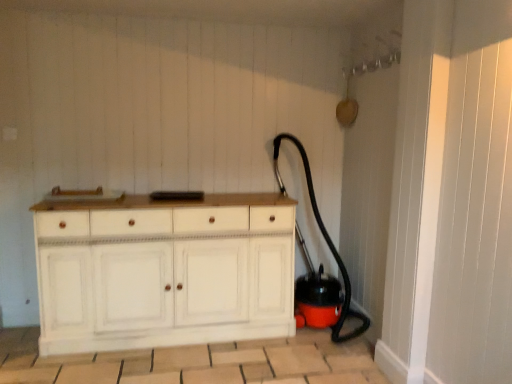
Question: Is white wood chest of drawers at center spatially inside black rubber garden hose at lower right, or outside of it?

Choices:
 (A) inside
 (B) outside

Answer: (B)

Question: Is white wood chest of drawers at center to the left or to the right of black rubber garden hose at lower right in the image?

Choices:
 (A) left
 (B) right

Answer: (A)

Question: From a real-world perspective, is white wood chest of drawers at center above or below black rubber garden hose at lower right?

Choices:
 (A) above
 (B) below

Answer: (B)

Question: Is point (338, 319) positioned closer to the camera than point (259, 317)?

Choices:
 (A) farther
 (B) closer

Answer: (A)

Question: Looking at the image, does black rubber garden hose at lower right seem bigger or smaller compared to white wood chest of drawers at center?

Choices:
 (A) big
 (B) small

Answer: (B)

Question: Which is correct: black rubber garden hose at lower right is inside white wood chest of drawers at center, or outside of it?

Choices:
 (A) inside
 (B) outside

Answer: (B)

Question: From a real-world perspective, is black rubber garden hose at lower right physically located above or below white wood chest of drawers at center?

Choices:
 (A) above
 (B) below

Answer: (A)